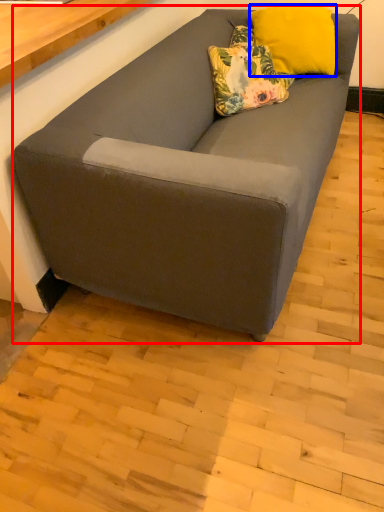
Question: Which object appears closest to the camera in this image, studio couch (highlighted by a red box) or pillow (highlighted by a blue box)?

Choices:
 (A) studio couch
 (B) pillow

Answer: (A)